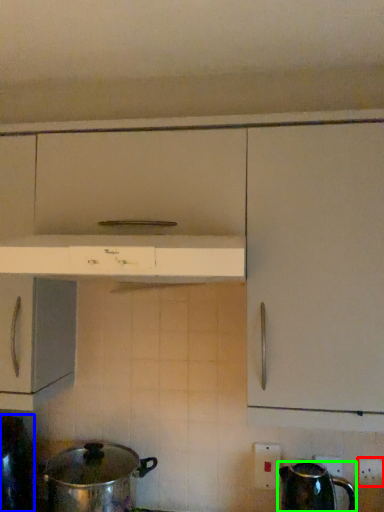
Question: Based on their relative distances, which object is nearer to electric outlet (highlighted by a red box)? Choose from kitchen appliance (highlighted by a blue box) and kettle (highlighted by a green box).

Choices:
 (A) kitchen appliance
 (B) kettle

Answer: (B)